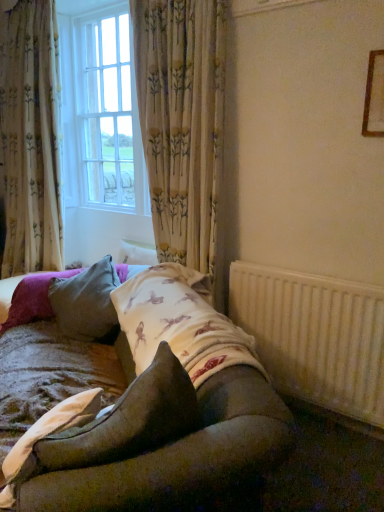
Question: From their relative heights in the image, would you say white textured radiator at lower right is taller or shorter than textured beige quilt at lower left?

Choices:
 (A) short
 (B) tall

Answer: (B)

Question: Relative to textured beige quilt at lower left, is white textured radiator at lower right in front or behind?

Choices:
 (A) front
 (B) behind

Answer: (B)

Question: Estimate the real-world distances between objects in this image. Which object is farther from the textured beige quilt at lower left?

Choices:
 (A) floral fabric curtain at left, arranged as the second curtain when viewed from the right
 (B) velvet brown pillow at center, arranged as the first pillow when viewed from the front
 (C) floral fabric curtain at center, which is the second curtain in left-to-right order
 (D) white glass window at upper left
 (E) velvet gray pillow at center, which ranks as the second pillow in front-to-back order

Answer: (D)

Question: Which is nearer to the velvet brown pillow at center, the 2th pillow viewed from the back?

Choices:
 (A) velvet gray pillow at center, which ranks as the second pillow in front-to-back order
 (B) white textured radiator at lower right
 (C) textured beige quilt at lower left
 (D) wooden frame at upper right
 (E) floral fabric curtain at left, the first curtain positioned from the left

Answer: (C)